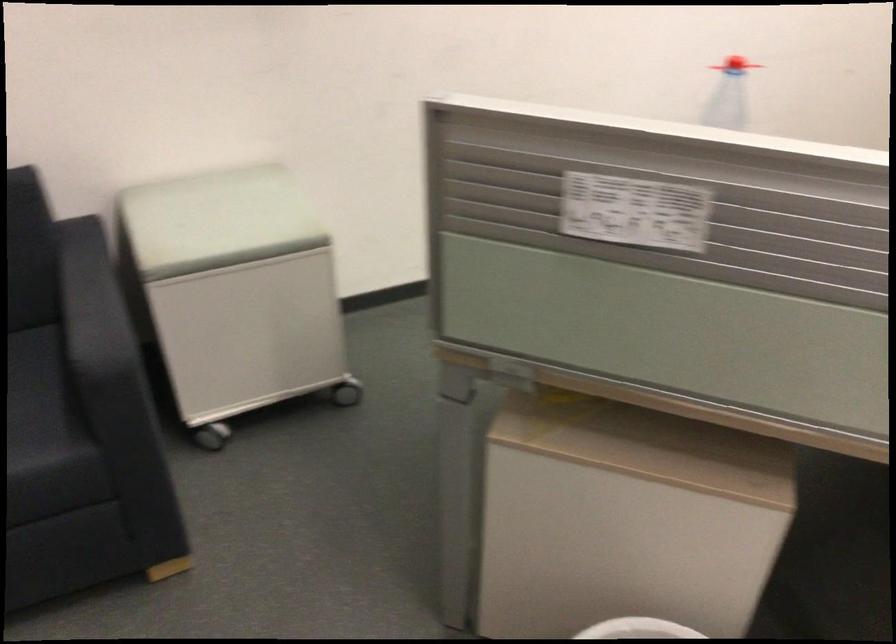
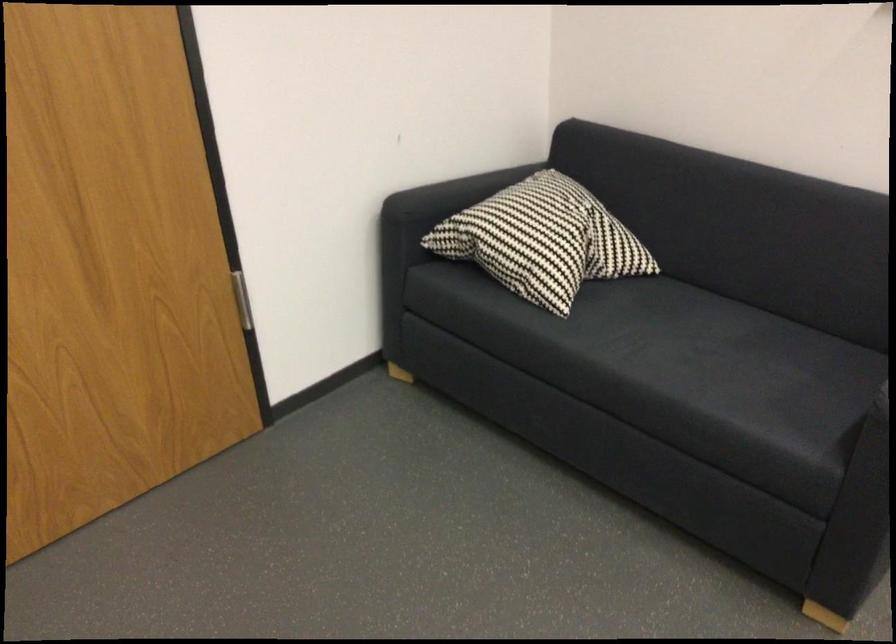
First-person continuous shooting, in which direction is the camera rotating?

The camera's rotation is toward left-down.